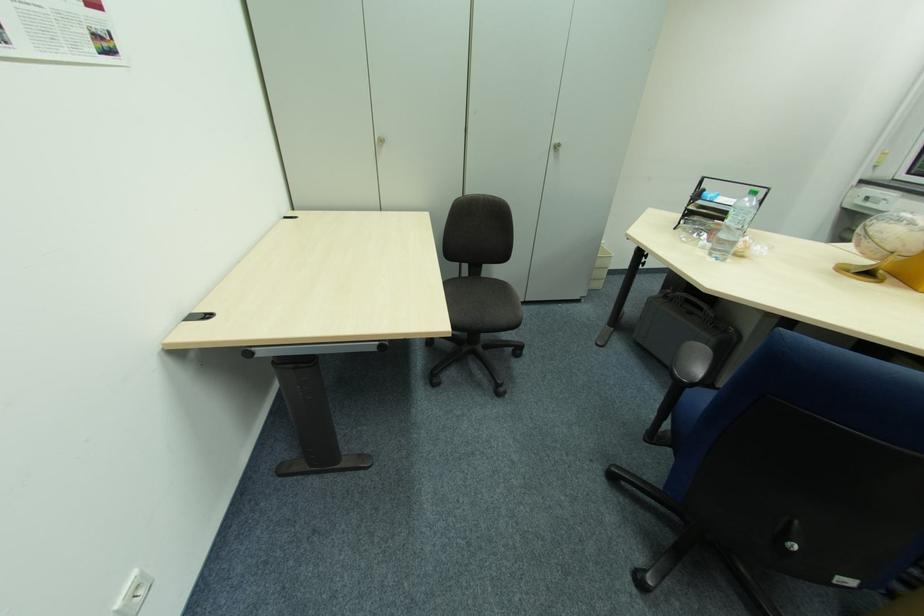
In order to click on grey hard case handle in this screenshot , I will do (x=690, y=305).